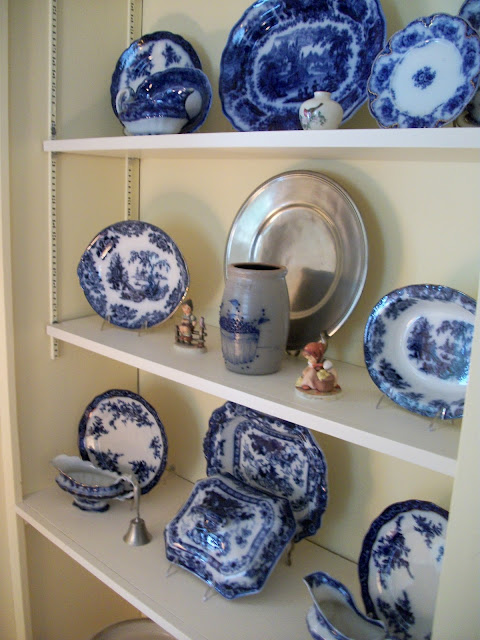
Identify the location of lower shelf. (202, 625).